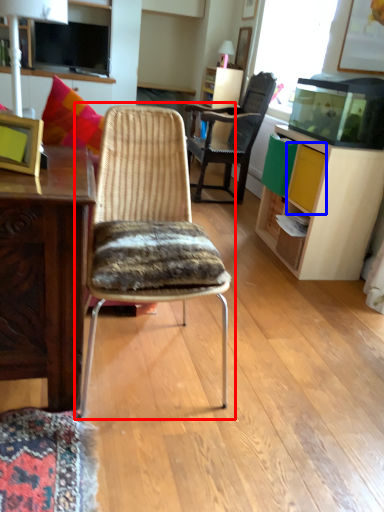
Question: Which object is further to the camera taking this photo, chair (highlighted by a red box) or drawer (highlighted by a blue box)?

Choices:
 (A) chair
 (B) drawer

Answer: (B)